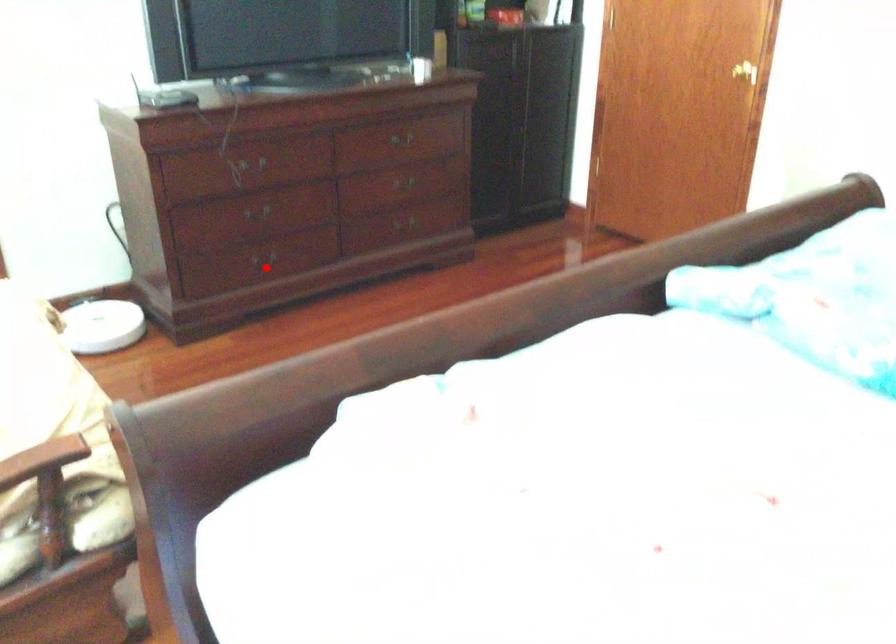
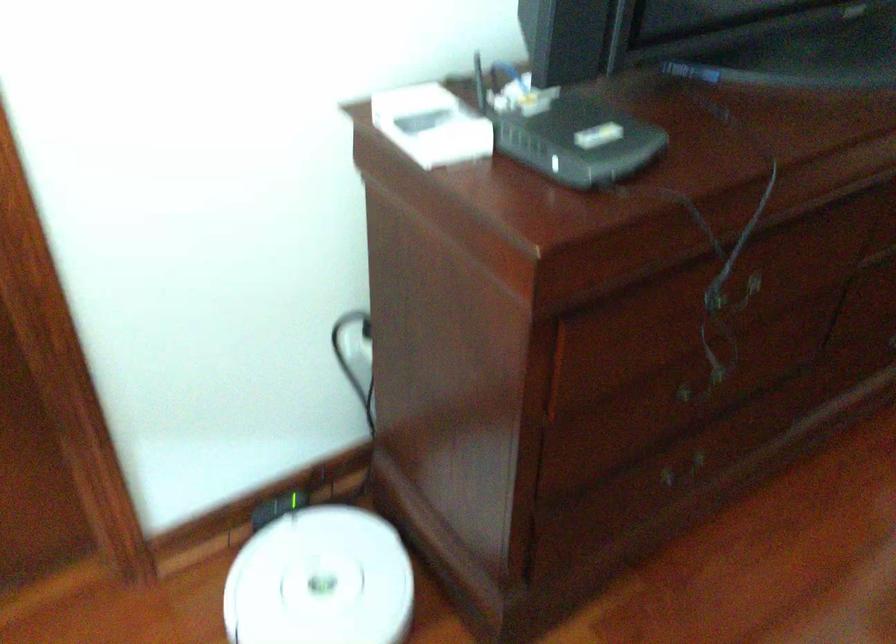
Question: I am providing you with two images of the same scene from different viewpoints. A red point is marked on the first image. At the location where the point appears in image 1, is it still visible in image 2?

Choices:
 (A) Yes
 (B) No

Answer: (A)